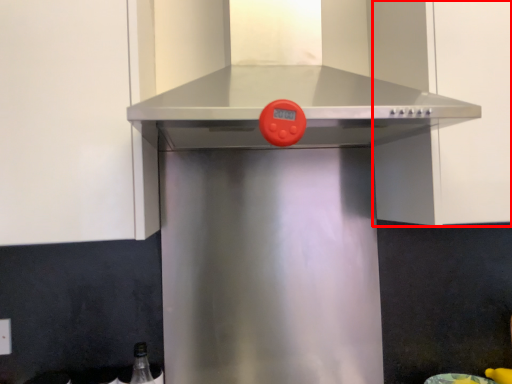
Question: From the image, what is the correct spatial relationship of cabinetry (annotated by the red box) in relation to vent?

Choices:
 (A) right
 (B) left

Answer: (A)